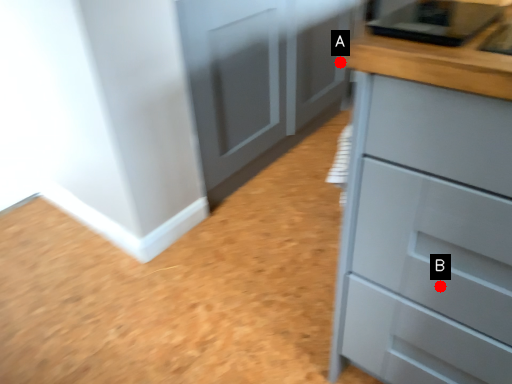
Question: Two points are circled on the image, labeled by A and B beside each circle. Which point appears farthest from the camera in this image?

Choices:
 (A) A is further
 (B) B is further

Answer: (A)